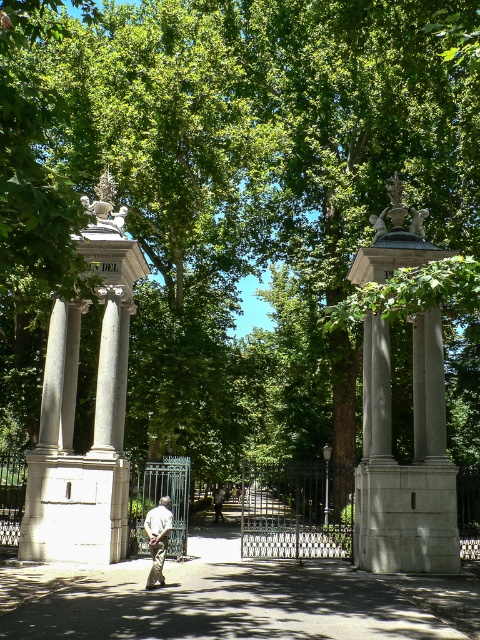
Does gray stone column at left have a lesser height compared to light brown leather jacket at center?

Yes, gray stone column at left is shorter than light brown leather jacket at center.

Can you confirm if gray stone column at left is taller than light brown leather jacket at center?

Incorrect, gray stone column at left's height is not larger of light brown leather jacket at center's.

You are a GUI agent. You are given a task and a screenshot of the screen. Output one action in this format:
    pyautogui.click(x=<x>, y=<y>)
    Task: Click on the gray stone column at left
    
    Given the screenshot: What is the action you would take?
    click(95, 410)

Is gray stone column at left to the left of camouflage fabric pants at center from the viewer's perspective?

Indeed, gray stone column at left is positioned on the left side of camouflage fabric pants at center.

In the scene shown: Between gray stone column at left and camouflage fabric pants at center, which one is positioned higher?

gray stone column at left

Who is more distant from viewer, (124, 492) or (162, 568)?

Point (124, 492)

The width and height of the screenshot is (480, 640). In order to click on gray stone column at left in this screenshot , I will do `click(95, 410)`.

Is point (153, 572) farther from camera compared to point (223, 499)?

No, it is in front of (223, 499).

Is camouflage fabric pants at center to the left of light brown leather jacket at center from the viewer's perspective?

In fact, camouflage fabric pants at center is to the right of light brown leather jacket at center.

This screenshot has height=640, width=480. I want to click on camouflage fabric pants at center, so click(157, 538).